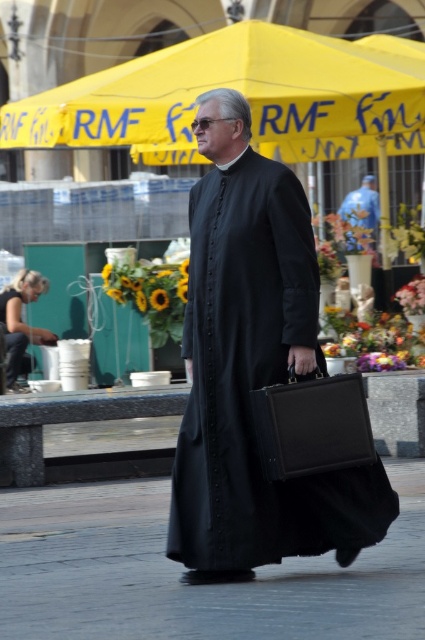
Consider the image. You are a delivery person trying to place a package on the smooth concrete pavement at center. However, you notice the black matte robe at lower left is in the way. Can you place the package there without moving the robe?

The smooth concrete pavement at center is not as tall as black matte robe at lower left, meaning the robe is taller than the pavement. Since the robe is on the ground, it is blocking the area, so you cannot place the package there without moving the robe.

In the scene shown: You are a delivery person trying to find a smooth surface to place a heavy box. You see the point marked at coordinates (x=183, y=570). Based on the scene description, is the surface at that point suitable for placing the box?

The point at coordinates (x=183, y=570) indicates smooth concrete pavement at center, which is suitable for placing a heavy box as it provides a stable and flat surface.